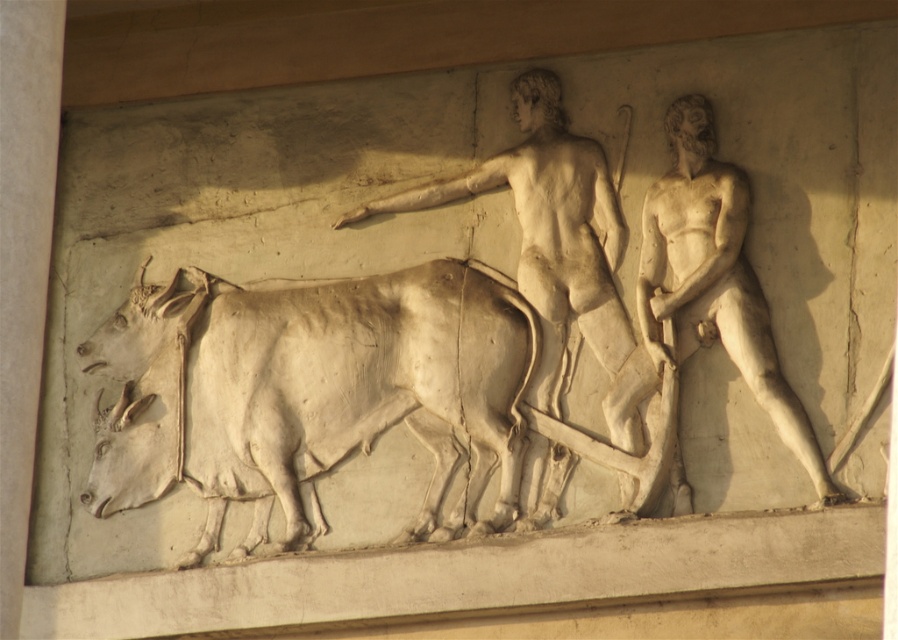
You are an art conservator examining the classical relief sculpture. You notice two figures, the white marble man at center and the white marble man at right. Which of these two figures is positioned to the left of the other?

The white marble man at center is positioned to the left of the white marble man at right.

Based on the scene description, can you determine which object takes up more space in the image between the white stone cow at center and the white marble man at center?

The white marble man at center occupies more space than the white stone cow at center according to the description.

Consider the image. You are an art conservator examining the classical relief sculpture. You need to determine the relative sizes of the white stone cow at center and the white marble man at right. Which one is taller?

The white marble man at right is taller than the white stone cow at center according to the description.